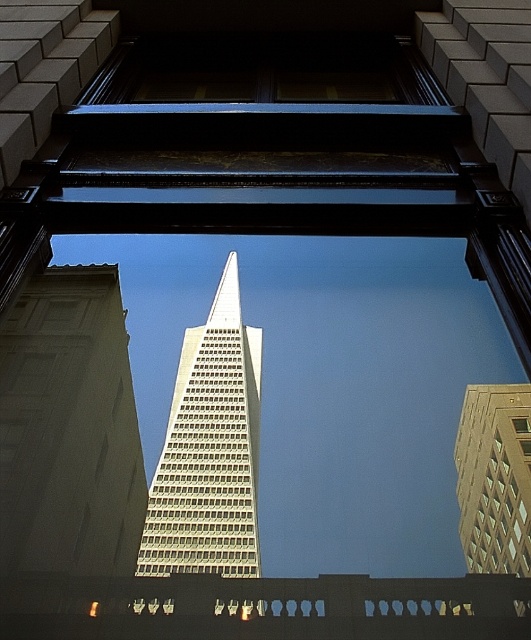
Question: Does white glass skyscraper at center have a smaller size compared to gold glass building at center?

Choices:
 (A) no
 (B) yes

Answer: (A)

Question: Which point is closer to the camera taking this photo?

Choices:
 (A) (491, 499)
 (B) (247, 376)

Answer: (A)

Question: Considering the relative positions of white glass skyscraper at center and gold glass building at center in the image provided, where is white glass skyscraper at center located with respect to gold glass building at center?

Choices:
 (A) right
 (B) left

Answer: (B)

Question: Where is white glass skyscraper at center located in relation to gold glass building at center in the image?

Choices:
 (A) right
 (B) left

Answer: (B)

Question: Which of the following is the closest to the observer?

Choices:
 (A) (482, 448)
 (B) (244, 492)

Answer: (A)

Question: Among these objects, which one is farthest from the camera?

Choices:
 (A) white glass skyscraper at center
 (B) gold glass building at center

Answer: (A)